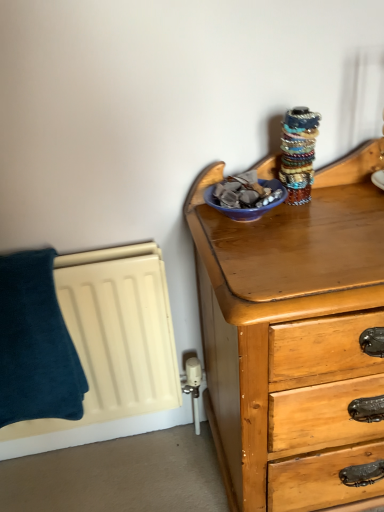
Question: Does blue glossy bowl at upper right turn towards dark blue plush towel at left?

Choices:
 (A) yes
 (B) no

Answer: (B)

Question: Is blue glossy bowl at upper right far from dark blue plush towel at left?

Choices:
 (A) no
 (B) yes

Answer: (A)

Question: From the image's perspective, is blue glossy bowl at upper right located beneath dark blue plush towel at left?

Choices:
 (A) no
 (B) yes

Answer: (A)

Question: Is blue glossy bowl at upper right in front of dark blue plush towel at left?

Choices:
 (A) no
 (B) yes

Answer: (B)

Question: Is the position of blue glossy bowl at upper right more distant than that of dark blue plush towel at left?

Choices:
 (A) yes
 (B) no

Answer: (B)

Question: Can you confirm if blue glossy bowl at upper right is shorter than dark blue plush towel at left?

Choices:
 (A) no
 (B) yes

Answer: (B)

Question: Can you confirm if dark blue plush towel at left is shorter than blue glossy bowl at upper right?

Choices:
 (A) yes
 (B) no

Answer: (B)

Question: Is there a large distance between dark blue plush towel at left and blue glossy bowl at upper right?

Choices:
 (A) no
 (B) yes

Answer: (A)

Question: Considering the relative positions of dark blue plush towel at left and blue glossy bowl at upper right in the image provided, is dark blue plush towel at left to the right of blue glossy bowl at upper right from the viewer's perspective?

Choices:
 (A) yes
 (B) no

Answer: (B)

Question: From a real-world perspective, is dark blue plush towel at left on top of blue glossy bowl at upper right?

Choices:
 (A) no
 (B) yes

Answer: (A)

Question: Considering the relative sizes of dark blue plush towel at left and blue glossy bowl at upper right in the image provided, is dark blue plush towel at left thinner than blue glossy bowl at upper right?

Choices:
 (A) no
 (B) yes

Answer: (A)

Question: Considering the relative sizes of dark blue plush towel at left and blue glossy bowl at upper right in the image provided, is dark blue plush towel at left smaller than blue glossy bowl at upper right?

Choices:
 (A) no
 (B) yes

Answer: (A)

Question: Visually, is dark blue plush towel at left positioned to the left or to the right of blue glossy bowl at upper right?

Choices:
 (A) left
 (B) right

Answer: (A)